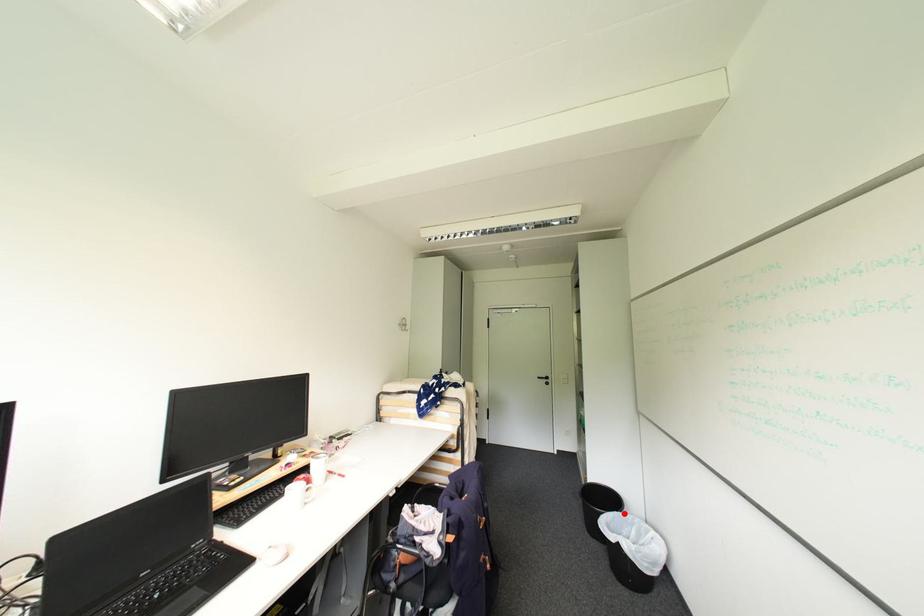
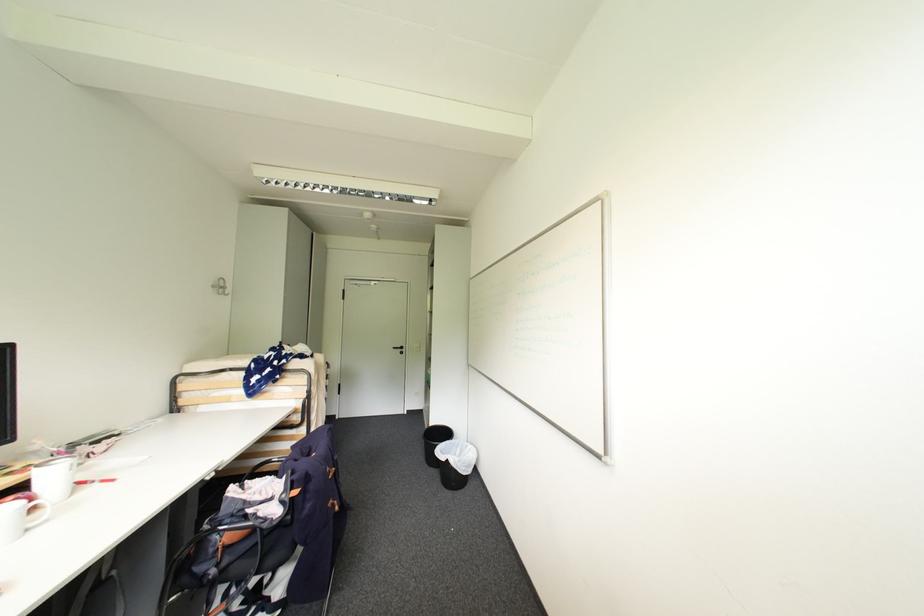
In the second image, find the point that corresponds to the highlighted location in the first image.

(456, 442)